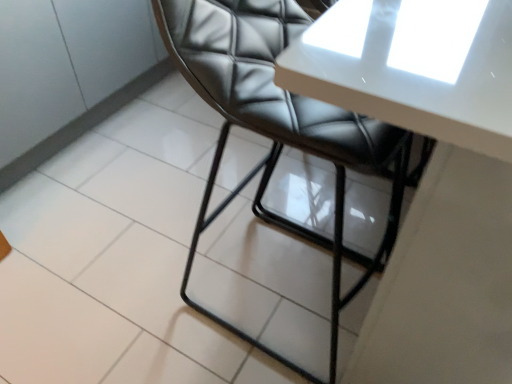
Locate an element on the screen. vacant space to the left of black leather chair at center is located at coordinates [x=146, y=283].